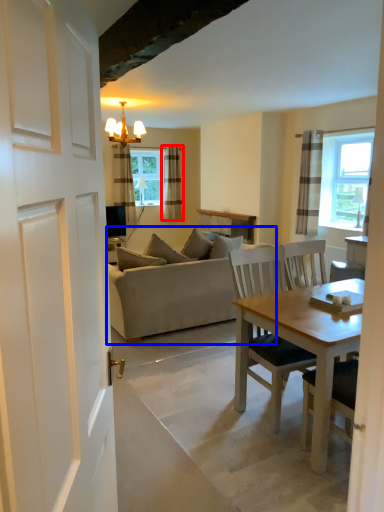
Question: Which of the following is the closest to the observer, curtain (highlighted by a red box) or studio couch (highlighted by a blue box)?

Choices:
 (A) curtain
 (B) studio couch

Answer: (B)